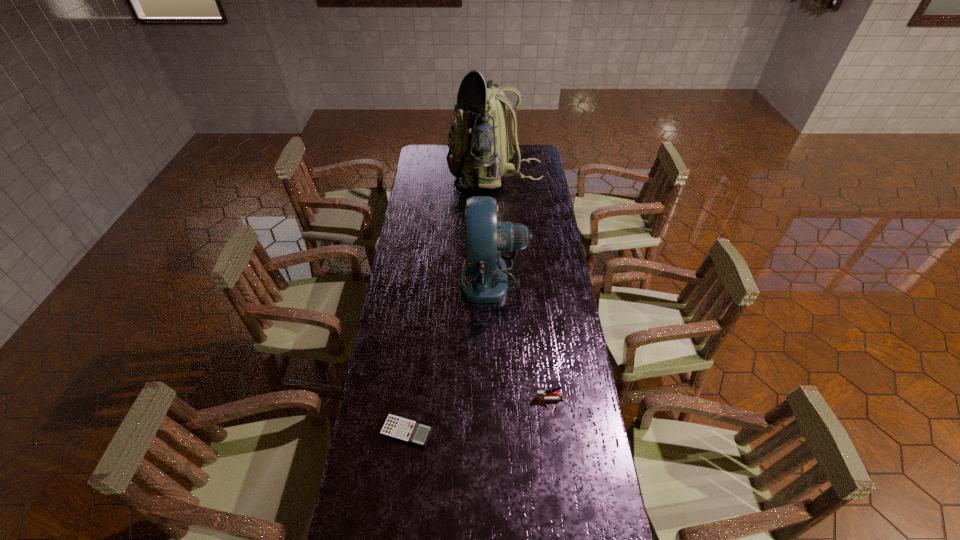
Find the location of a particular element. The image size is (960, 540). backpack positioned at the right edge is located at coordinates (479, 152).

Find the location of a particular element. stapler that is positioned at the right edge is located at coordinates (541, 395).

You are a GUI agent. You are given a task and a screenshot of the screen. Output one action in this format:
    pyautogui.click(x=<x>, y=<y>)
    Task: Click on the object positioned at the far right corner
    The image size is (960, 540).
    Given the screenshot: What is the action you would take?
    pyautogui.click(x=479, y=152)

At what (x,y) coordinates should I click in order to perform the action: click on free space at the left edge. Please return your answer as a coordinate pair (x, y). Looking at the image, I should click on (407, 377).

I want to click on vacant space at the right edge, so click(x=578, y=497).

This screenshot has height=540, width=960. In order to click on vacant region at the far left corner of the desktop in this screenshot , I will do tap(435, 164).

What are the coordinates of `free point between the tallest object and the third tallest object` in the screenshot? It's located at (522, 288).

This screenshot has height=540, width=960. What are the coordinates of `empty location between the third farthest object and the farthest object` in the screenshot? It's located at (522, 288).

Where is `free space that is in between the shortest object and the fan`? This screenshot has width=960, height=540. free space that is in between the shortest object and the fan is located at coordinates (450, 354).

In order to click on free spot between the fan and the third farthest object in this screenshot , I will do `click(522, 338)`.